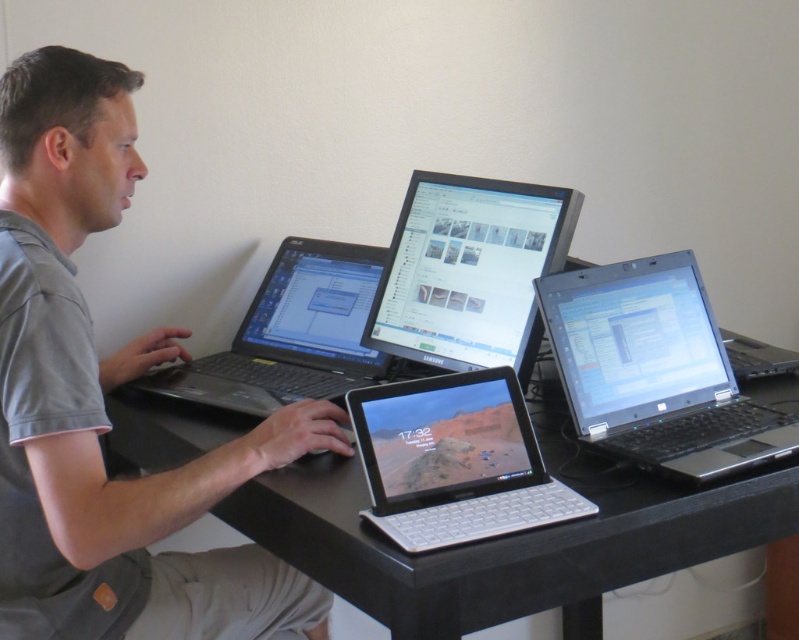
Question: Does black plastic laptop at right appear on the left side of black matte laptop at left?

Choices:
 (A) no
 (B) yes

Answer: (A)

Question: Among these objects, which one is farthest from the camera?

Choices:
 (A) white plastic tablet at center
 (B) satin black monitor at center
 (C) black matte laptop at left
 (D) black plastic laptop at right

Answer: (B)

Question: Does white plastic tablet at center appear on the left side of black matte laptop at left?

Choices:
 (A) yes
 (B) no

Answer: (B)

Question: Can you confirm if gray fabric shirt at left is smaller than black plastic laptop at right?

Choices:
 (A) no
 (B) yes

Answer: (A)

Question: Estimate the real-world distances between objects in this image. Which object is farther from the white plastic tablet at center?

Choices:
 (A) gray fabric shirt at left
 (B) black plastic table at center
 (C) black matte laptop at left

Answer: (C)

Question: Which object is positioned closest to the satin black monitor at center?

Choices:
 (A) black plastic table at center
 (B) black matte laptop at left

Answer: (B)